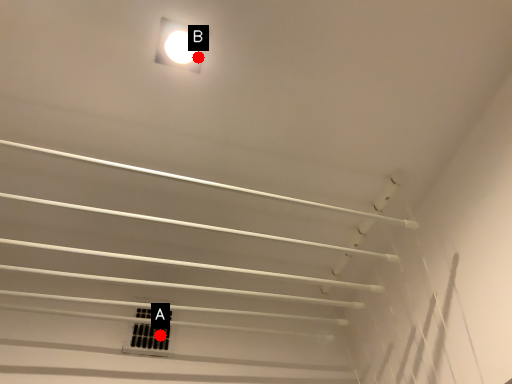
Question: Two points are circled on the image, labeled by A and B beside each circle. Which point is further to the camera?

Choices:
 (A) A is further
 (B) B is further

Answer: (A)